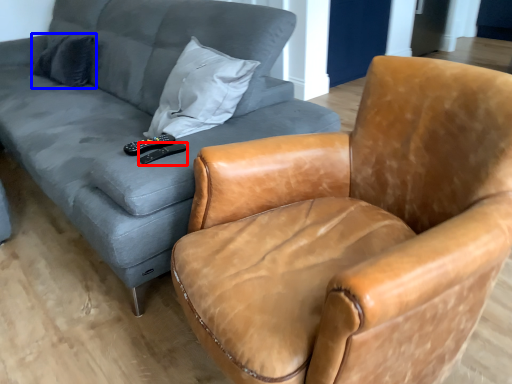
Question: Which point is closer to the camera, remote (highlighted by a red box) or pillow (highlighted by a blue box)?

Choices:
 (A) remote
 (B) pillow

Answer: (A)